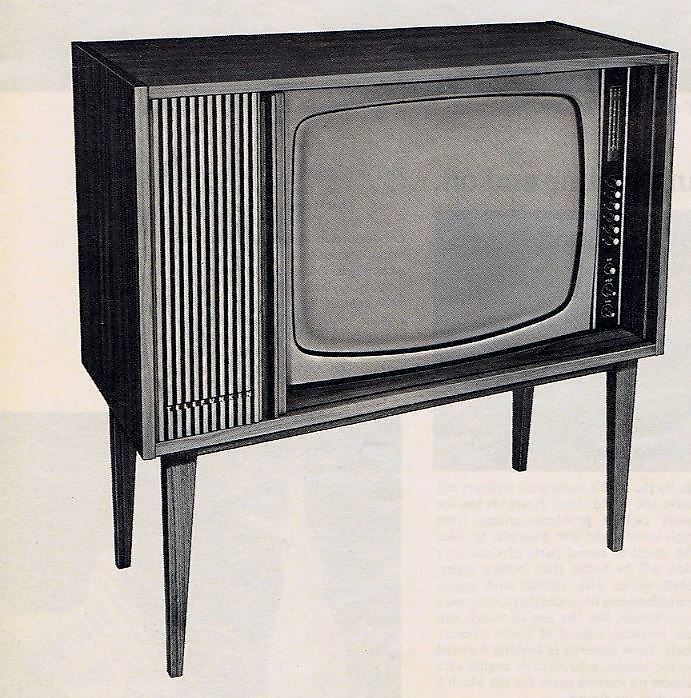
Locate an element on the screen. The image size is (691, 698). tv is located at coordinates (454, 218).